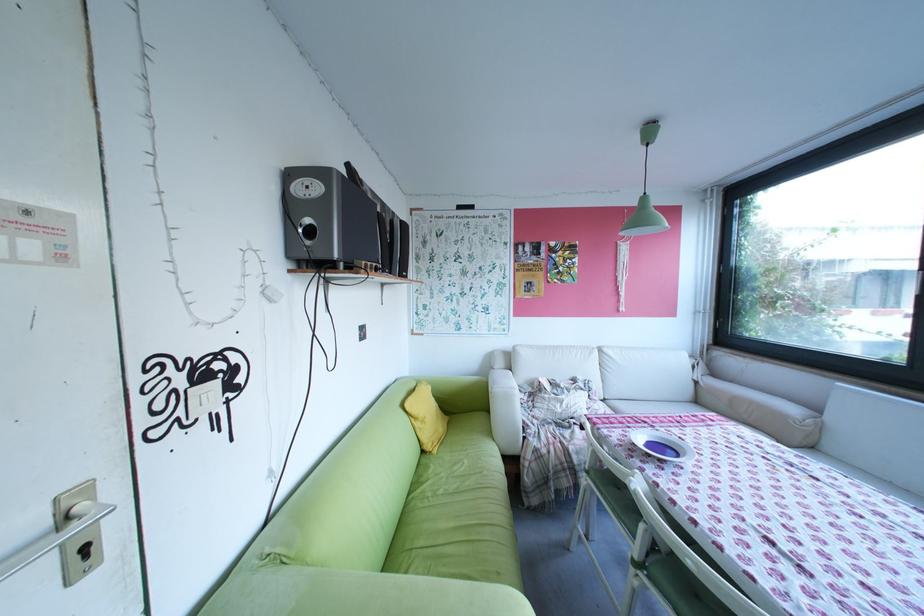
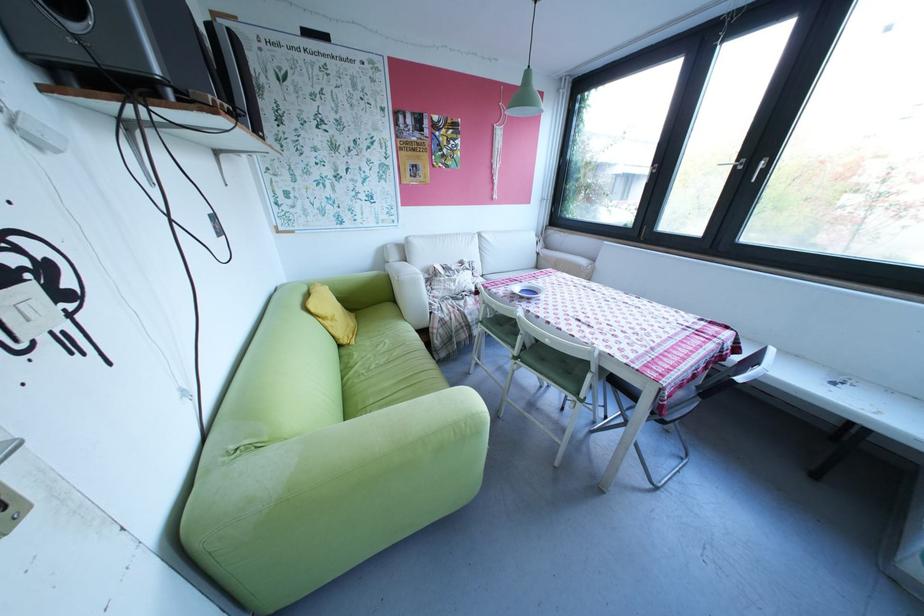
Find the pixel in the second image that matches the point at 430,424 in the first image.

(339, 323)